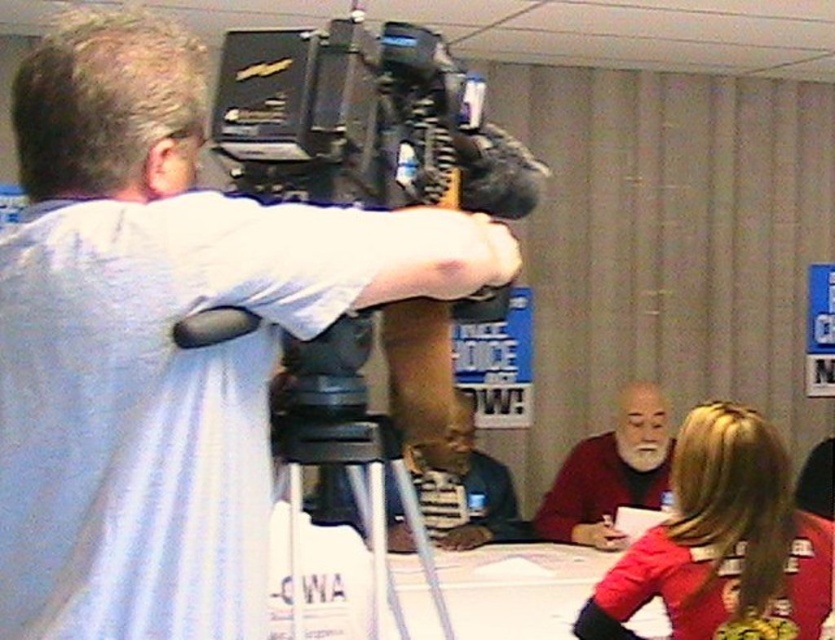
You are standing in the conference room and need to locate the matte black camera at upper left. According to the scene description, where exactly is the matte black camera positioned in relation to the other objects?

The matte black camera at upper left is positioned at coordinates point (162,339).

You are a technician who needs to move a 1.5 meter long cable from the matte black camera at upper left to the red fabric shirt at lower right. Based on the scene, will the cable be long enough to reach without needing to move either object?

The distance between the matte black camera at upper left and the red fabric shirt at lower right is 1.51 meters. The cable is 1.5 meters long, which is slightly shorter than the required distance. Therefore, the cable will not be long enough to reach without moving either object.